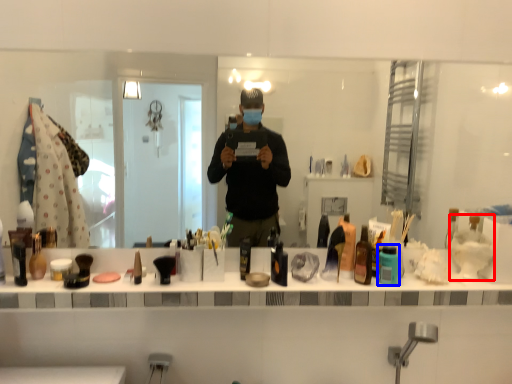
Question: Which object appears farthest to the camera in this image, shaving cream (highlighted by a red box) or toiletry (highlighted by a blue box)?

Choices:
 (A) shaving cream
 (B) toiletry

Answer: (A)